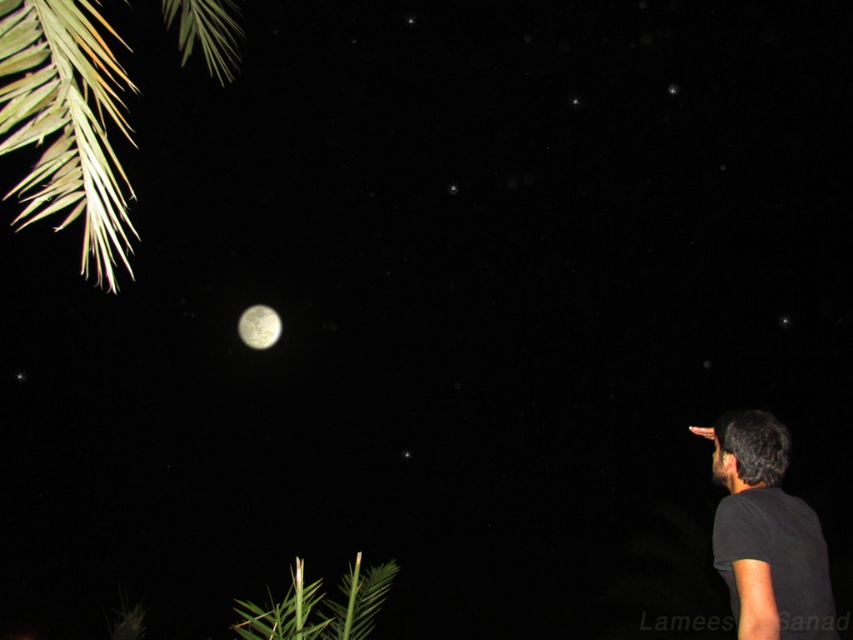
You are an astronomer observing the night sky. You notice the black matte shirt at lower right and the smooth silver moon at center. Which object is positioned higher in the image?

The smooth silver moon at center is positioned higher in the image than the black matte shirt at lower right.

You are an astronomer observing the night sky. You notice the green leafy branch at upper left and the smooth silver moon at center. Which object is positioned in front of the other?

The green leafy branch at upper left is closer to the viewer than the smooth silver moon at center, so it is positioned in front of the moon.

You are an astronomer observing the night sky. You notice a green leafy branch at upper left and a black matte shirt at lower right in your field of view. Which object appears bigger in the image?

The green leafy branch at upper left appears bigger than the black matte shirt at lower right in the image.